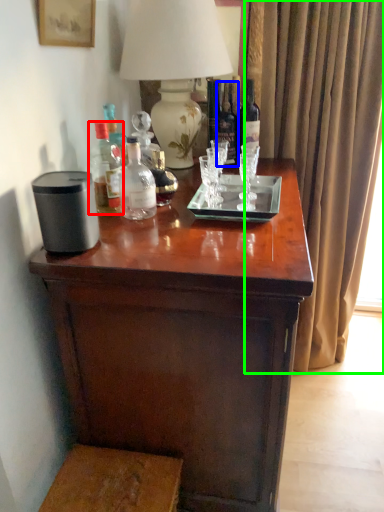
Question: Considering the real-world distances, which object is closest to bottle (highlighted by a red box)? bottle (highlighted by a blue box) or curtain (highlighted by a green box).

Choices:
 (A) bottle
 (B) curtain

Answer: (A)